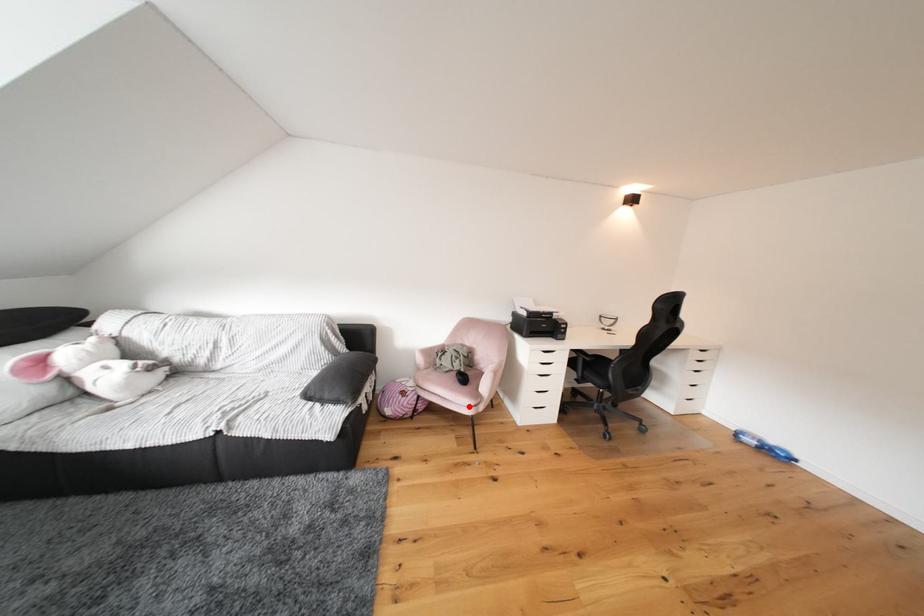
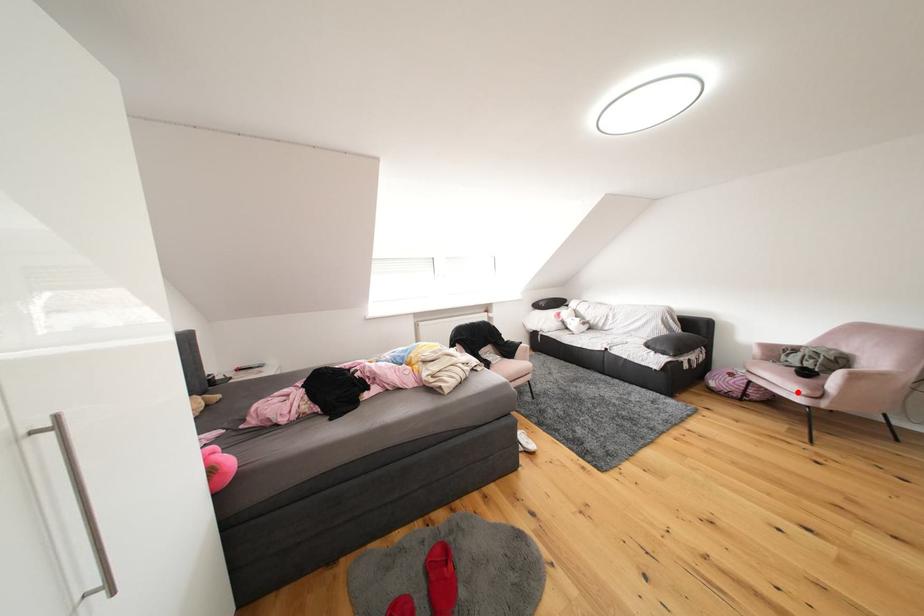
I am providing you with two images of the same scene from different viewpoints. A red point is marked on the first image and another point is marked on the second image. Is the red point in image1 aligned with the point shown in image2?

Yes